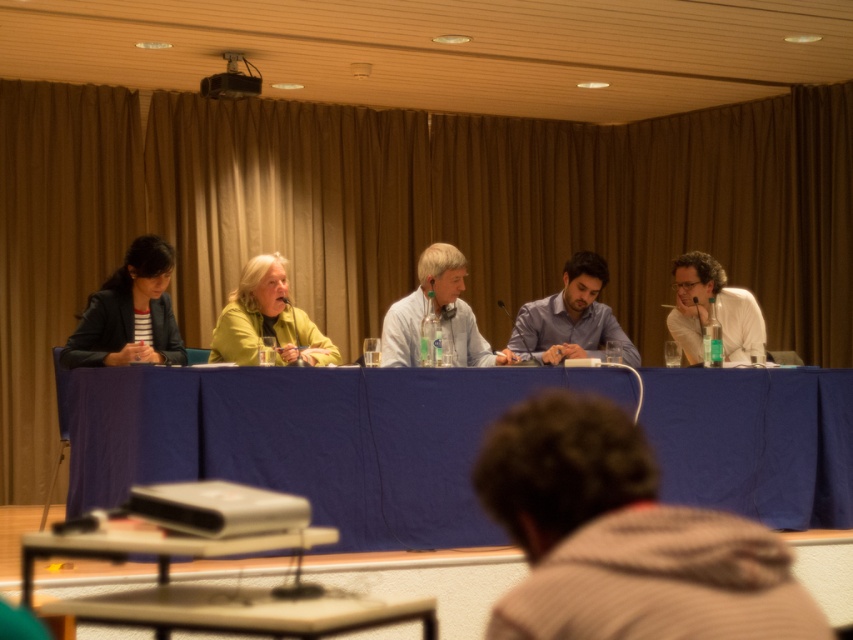
Question: Which of the following is the farthest from the observer?

Choices:
 (A) (164, 241)
 (B) (695, 326)
 (C) (583, 273)

Answer: (B)

Question: Does matte black blazer at left come behind green matte jacket at center?

Choices:
 (A) no
 (B) yes

Answer: (A)

Question: Among these points, which one is farthest from the camera?

Choices:
 (A) (463, 278)
 (B) (129, 481)
 (C) (590, 260)

Answer: (A)

Question: Is green matte jacket at center to the right of blue shirt at center from the viewer's perspective?

Choices:
 (A) no
 (B) yes

Answer: (A)

Question: Is blue fabric table at center wider than matte black blazer at left?

Choices:
 (A) no
 (B) yes

Answer: (B)

Question: Which is nearer to the green matte jacket at center?

Choices:
 (A) light beige shirt at center
 (B) matte black blazer at left

Answer: (B)